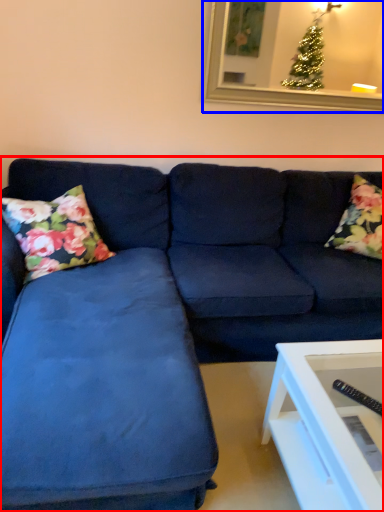
Question: Among these objects, which one is nearest to the camera, studio couch (highlighted by a red box) or picture frame (highlighted by a blue box)?

Choices:
 (A) studio couch
 (B) picture frame

Answer: (A)